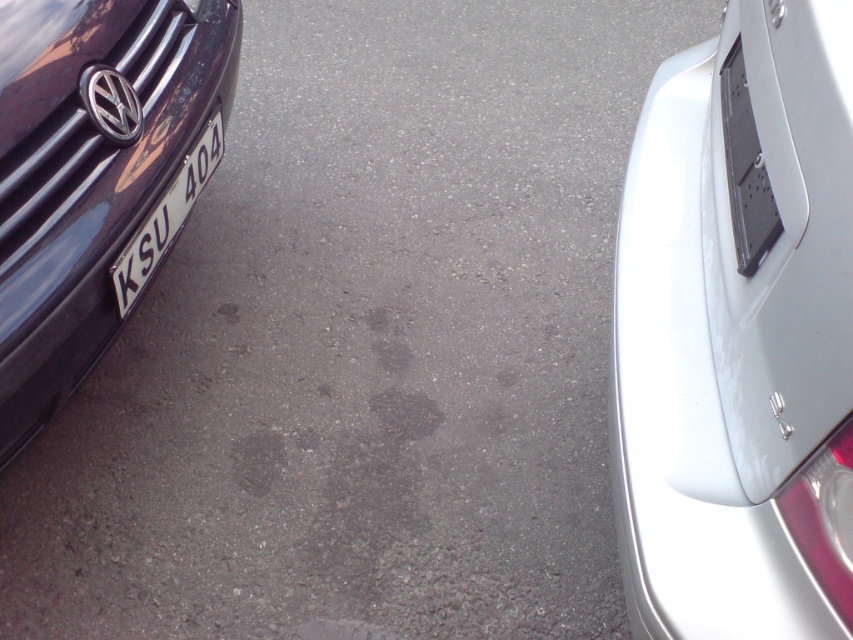
Between satin white bumper at right and glossy black car at left, which one appears on the left side from the viewer's perspective?

glossy black car at left

Measure the distance between point [612,419] and camera.

The distance of point [612,419] from camera is 4.66 feet.

This screenshot has width=853, height=640. Describe the element at coordinates (738, 333) in the screenshot. I see `satin white bumper at right` at that location.

The image size is (853, 640). I want to click on satin white bumper at right, so click(738, 333).

Between glossy black car at left and white glossy license plate at left, which one is positioned lower?

white glossy license plate at left

How much distance is there between glossy black car at left and white glossy license plate at left?

4.23 inches

Image resolution: width=853 pixels, height=640 pixels. I want to click on glossy black car at left, so tap(96, 176).

Between satin white bumper at right and white glossy license plate at left, which one has less height?

white glossy license plate at left

Can you confirm if satin white bumper at right is shorter than white glossy license plate at left?

No, satin white bumper at right is not shorter than white glossy license plate at left.

At what (x,y) coordinates should I click in order to perform the action: click on satin white bumper at right. Please return your answer as a coordinate pair (x, y). This screenshot has height=640, width=853. Looking at the image, I should click on (738, 333).